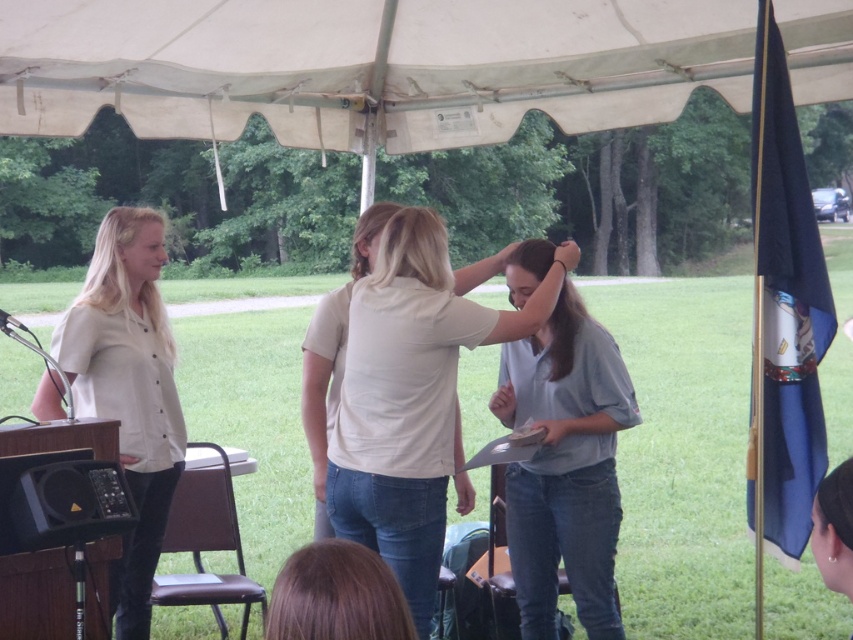
You are organizing a clothing display and need to arrange the light blue denim shirt at center and the matte white blouse at left based on their sizes. Which one should you place first if you want to arrange them from smallest to largest?

The light blue denim shirt at center is smaller than the matte white blouse at left, so you should place the light blue denim shirt at center first when arranging from smallest to largest.

You are a photographer at an outdoor event under a white canopy tent. You need to capture a photo of the two people wearing the light blue denim shirt at center and the matte white blouse at left. Based on their positions, which one is positioned lower in the frame?

The light blue denim shirt at center is located below the matte white blouse at left, so the light blue denim shirt at center is positioned lower in the frame.

You are standing at the entrance of the large white canopy tent and see the point marked at coordinate [566,467]. What object is located at that point?

The light blue denim shirt at center is located at the point marked at coordinate [566,467].